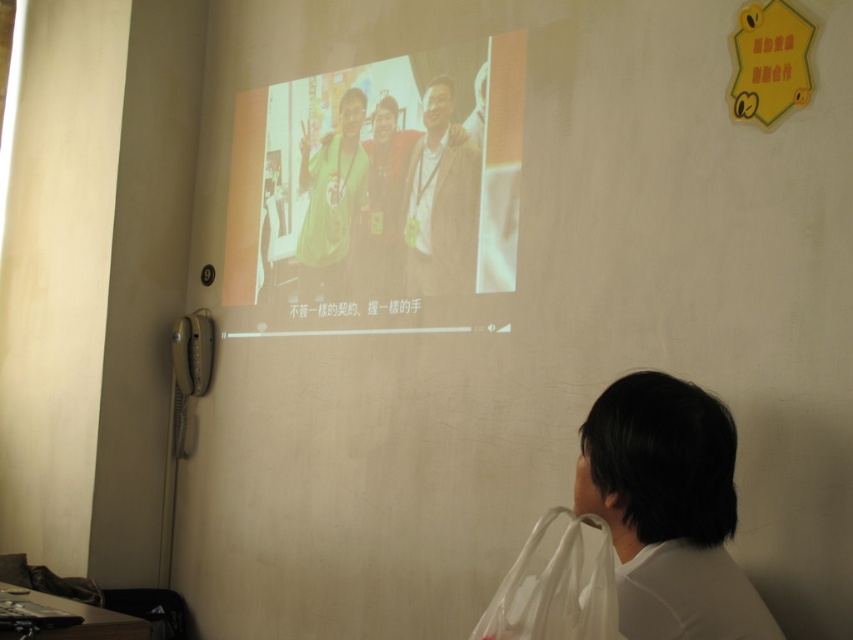
Question: Which point is farther to the camera?

Choices:
 (A) white plastic bag at lower right
 (B) matte plastic screen at upper center
 (C) matte brown jacket at center
 (D) green jersey at center

Answer: (D)

Question: Which object is farther from the camera taking this photo?

Choices:
 (A) green jersey at center
 (B) matte plastic screen at upper center

Answer: (A)

Question: Is the position of white plastic bag at lower right more distant than that of green jersey at center?

Choices:
 (A) no
 (B) yes

Answer: (A)

Question: Does matte brown jacket at center have a larger size compared to matte yellow shirt at center?

Choices:
 (A) no
 (B) yes

Answer: (B)

Question: Which point appears closest to the camera in this image?

Choices:
 (A) (308, 166)
 (B) (337, 282)
 (C) (379, 120)

Answer: (C)

Question: Does white plastic bag at lower right appear on the left side of green jersey at center?

Choices:
 (A) yes
 (B) no

Answer: (B)